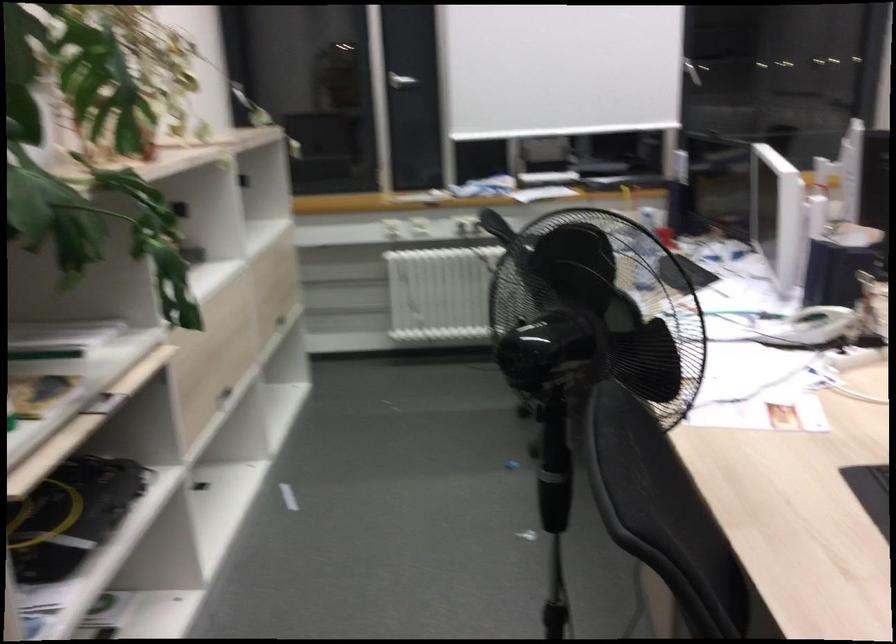
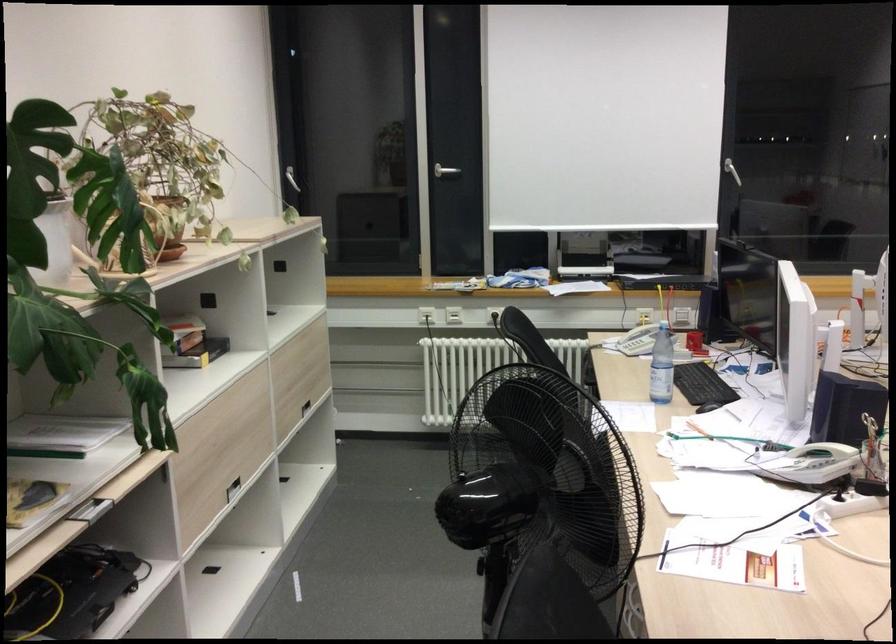
In the second image, find the point that corresponds to pixel 660 237 in the first image.

(694, 343)